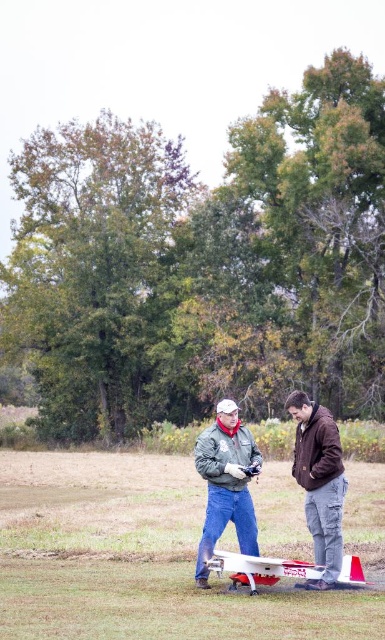
Question: Which object is the closest to the brown matte jacket at center?

Choices:
 (A) white matte airplane at center
 (B) matte gray jacket at center

Answer: (A)

Question: Is brown matte jacket at center bigger than white matte airplane at center?

Choices:
 (A) yes
 (B) no

Answer: (A)

Question: Which point appears farthest from the camera in this image?

Choices:
 (A) (249, 440)
 (B) (311, 500)

Answer: (A)

Question: Which object is farther from the camera taking this photo?

Choices:
 (A) white matte airplane at center
 (B) matte gray jacket at center
 (C) brown matte jacket at center
 (D) gray matte jacket at center

Answer: (D)

Question: Can you confirm if matte gray jacket at center is positioned below brown matte jacket at center?

Choices:
 (A) no
 (B) yes

Answer: (B)

Question: Considering the relative positions of matte gray jacket at center and brown matte jacket at center in the image provided, where is matte gray jacket at center located with respect to brown matte jacket at center?

Choices:
 (A) above
 (B) below

Answer: (B)